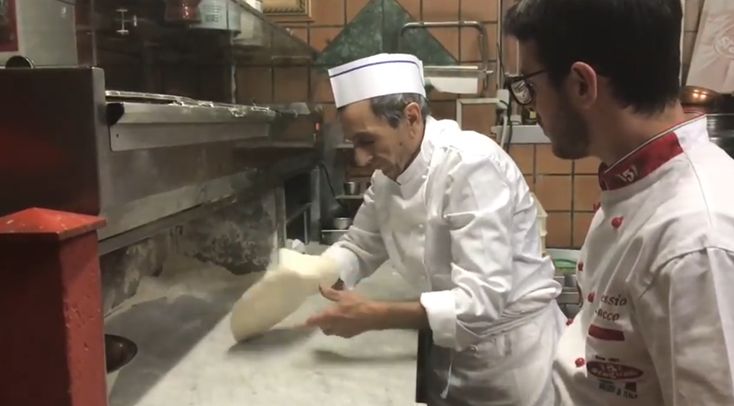
The width and height of the screenshot is (734, 406). Identify the location of kitchen appliance. (164, 163).